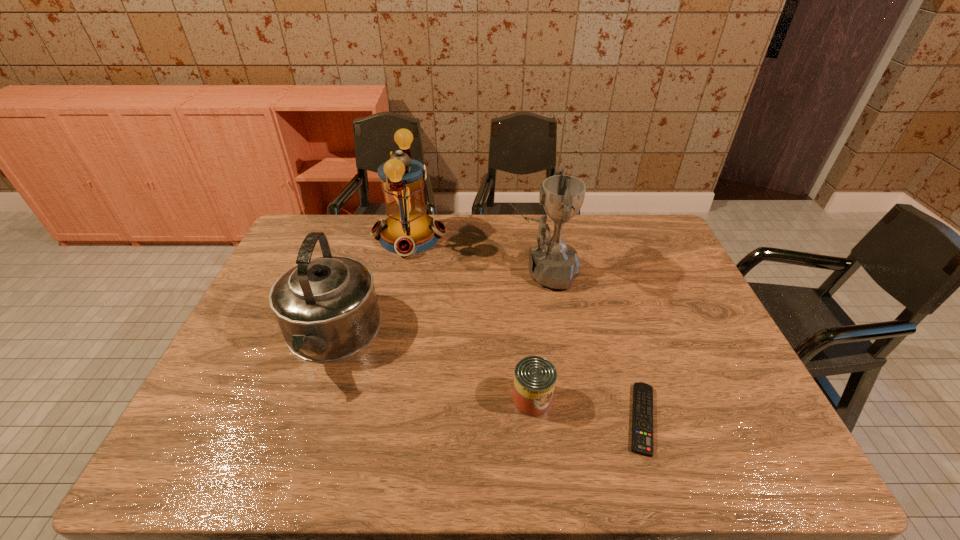
The height and width of the screenshot is (540, 960). Find the location of `vacant point that satisfies the following two spatial constraints: 1. on the side with emblem of the award; 2. with the spout at the front of the third tallest object`. vacant point that satisfies the following two spatial constraints: 1. on the side with emblem of the award; 2. with the spout at the front of the third tallest object is located at coordinates (553, 337).

I want to click on vacant space that satisfies the following two spatial constraints: 1. on the front-facing side of the remote control; 2. on the left side of the lantern, so click(372, 418).

At what (x,y) coordinates should I click in order to perform the action: click on vacant area that satisfies the following two spatial constraints: 1. on the side with emblem of the award; 2. with the spout at the front of the kettle. Please return your answer as a coordinate pair (x, y). The image size is (960, 540). Looking at the image, I should click on [x=553, y=337].

Locate an element on the screen. The height and width of the screenshot is (540, 960). free space in the image that satisfies the following two spatial constraints: 1. on the front-facing side of the lantern; 2. on the right side of the can is located at coordinates click(376, 399).

Where is `free location that satisfies the following two spatial constraints: 1. on the front-facing side of the shortest object; 2. on the left side of the lantern`? The image size is (960, 540). free location that satisfies the following two spatial constraints: 1. on the front-facing side of the shortest object; 2. on the left side of the lantern is located at coordinates (372, 418).